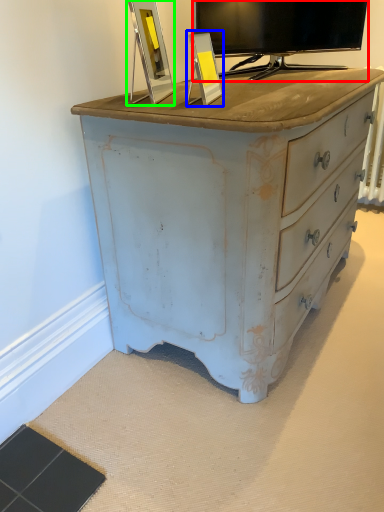
Question: Which object is the closest to the television (highlighted by a red box)? Choose among these: picture frame (highlighted by a blue box) or picture frame (highlighted by a green box).

Choices:
 (A) picture frame
 (B) picture frame

Answer: (B)